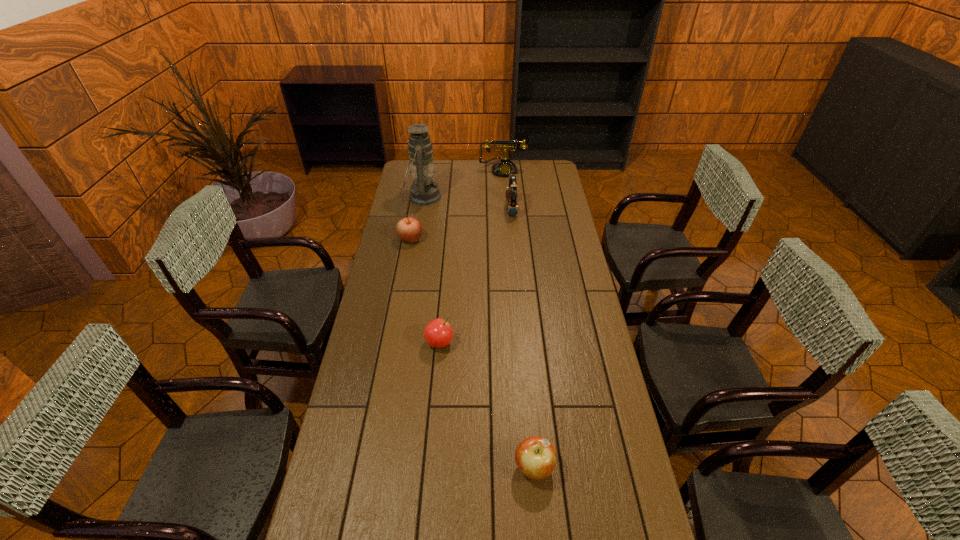
Find the location of a particular element. This screenshot has width=960, height=540. object that is the fifth closest to the leftmost apple is located at coordinates (535, 456).

Locate which object ranks fourth in proximity to the oil lamp. Please provide its 2D coordinates. Your answer should be formatted as a tuple, i.e. [(x, y)], where the tuple contains the x and y coordinates of a point satisfying the conditions above.

[(438, 333)]

I want to click on apple identified as the second closest to the headset, so click(x=438, y=333).

Identify which apple is the nearest to the headset. Please provide its 2D coordinates. Your answer should be formatted as a tuple, i.e. [(x, y)], where the tuple contains the x and y coordinates of a point satisfying the conditions above.

[(409, 229)]

This screenshot has height=540, width=960. What are the coordinates of `vacant space that satisfies the following two spatial constraints: 1. on the ear cup of the headset; 2. on the front side of the nearest apple` in the screenshot? It's located at (536, 467).

This screenshot has height=540, width=960. What are the coordinates of `free location that satisfies the following two spatial constraints: 1. on the ear cup of the headset; 2. on the front side of the farthest apple` in the screenshot? It's located at tap(515, 239).